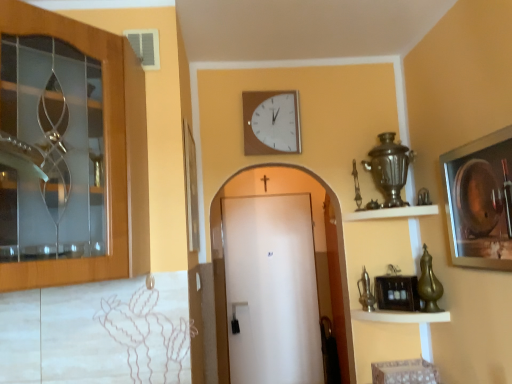
Locate an element on the screen. The height and width of the screenshot is (384, 512). metallic silver picture frame at right is located at coordinates pyautogui.click(x=480, y=201).

Measure the distance between wooden cabinet at left, marked as the 1th door in a front-to-back arrangement, and camera.

1.01 meters.

This screenshot has width=512, height=384. Find the location of `wooden cabinet at left, which appears as the 1th door when viewed from the left`. wooden cabinet at left, which appears as the 1th door when viewed from the left is located at coordinates (105, 154).

What do you see at coordinates (400, 316) in the screenshot? I see `metallic brass shelf at lower right, which is the 2th shelf from top to bottom` at bounding box center [400, 316].

Where is `white matte door at center, the 2th door from the front`? white matte door at center, the 2th door from the front is located at coordinates (315, 250).

How much space does white wooden shelf at upper right, the first shelf in the top-to-bottom sequence, occupy horizontally?

9.81 inches.

Locate an element on the screen. This screenshot has height=384, width=512. metallic silver picture frame at right is located at coordinates (x=480, y=201).

Is white wooden clock at upper center surrounding metallic silver picture frame at right?

Actually, metallic silver picture frame at right is outside white wooden clock at upper center.

Between point (274, 115) and point (453, 231), which one is positioned in front?

The point (453, 231) is more forward.

Considering the relative sizes of white wooden clock at upper center and metallic silver picture frame at right in the image provided, is white wooden clock at upper center shorter than metallic silver picture frame at right?

Indeed, white wooden clock at upper center has a lesser height compared to metallic silver picture frame at right.

Could you tell me if white wooden clock at upper center is turned towards metallic silver picture frame at right?

No, white wooden clock at upper center is not oriented towards metallic silver picture frame at right.

How different are the orientations of white wooden clock at upper center and metallic brass shelf at lower right, arranged as the 1th shelf when ordered from the bottom, in degrees?

0.927 degrees.

Is white wooden clock at upper center not close to metallic brass shelf at lower right, which is the 2th shelf from top to bottom?

white wooden clock at upper center is far away from metallic brass shelf at lower right, which is the 2th shelf from top to bottom.

Choose the correct answer: Is white wooden clock at upper center inside metallic brass shelf at lower right, arranged as the 1th shelf when ordered from the bottom, or outside it?

white wooden clock at upper center is located beyond the bounds of metallic brass shelf at lower right, arranged as the 1th shelf when ordered from the bottom.

Which point is more distant from viewer, (249, 94) or (382, 316)?

Point (249, 94)

From a real-world perspective, between white matte door at center, the first door positioned from the right, and metallic silver picture frame at right, who is vertically higher?

metallic silver picture frame at right is physically above.

Which is more to the left, white matte door at center, the first door in the bottom-to-top sequence, or metallic silver picture frame at right?

white matte door at center, the first door in the bottom-to-top sequence.

Is white matte door at center, the first door positioned from the right, far away from metallic silver picture frame at right?

Yes, white matte door at center, the first door positioned from the right, is far from metallic silver picture frame at right.

Is wooden cabinet at left, the 2th door viewed from the back, inside the boundaries of white wooden shelf at upper right, which appears as the second shelf when ordered from the bottom, or outside?

wooden cabinet at left, the 2th door viewed from the back, is spatially situated outside white wooden shelf at upper right, which appears as the second shelf when ordered from the bottom.

Considering the sizes of wooden cabinet at left, the 2th door viewed from the right, and white wooden shelf at upper right, which appears as the second shelf when ordered from the bottom, in the image, is wooden cabinet at left, the 2th door viewed from the right, bigger or smaller than white wooden shelf at upper right, which appears as the second shelf when ordered from the bottom,?

In the image, wooden cabinet at left, the 2th door viewed from the right, appears to be larger than white wooden shelf at upper right, which appears as the second shelf when ordered from the bottom.

From a real-world perspective, which object rests below the other?

white wooden shelf at upper right, which appears as the second shelf when ordered from the bottom.

Considering the relative sizes of white wooden clock at upper center and white wooden shelf at upper right, which appears as the second shelf when ordered from the bottom, in the image provided, is white wooden clock at upper center bigger than white wooden shelf at upper right, which appears as the second shelf when ordered from the bottom,?

Actually, white wooden clock at upper center might be smaller than white wooden shelf at upper right, which appears as the second shelf when ordered from the bottom.

From a real-world perspective, which object stands above the other?

In real-world perspective, white wooden clock at upper center is above.

From their relative heights in the image, would you say white wooden clock at upper center is taller or shorter than white wooden shelf at upper right, the first shelf in the top-to-bottom sequence?

Clearly, white wooden clock at upper center is taller compared to white wooden shelf at upper right, the first shelf in the top-to-bottom sequence.

From the image's perspective, starting from the white wooden clock at upper center, which shelf is the 1st one below? Please provide its 2D coordinates.

[(392, 213)]

Is wooden cabinet at left, which appears as the 1th door when viewed from the left, situated inside white wooden clock at upper center or outside?

wooden cabinet at left, which appears as the 1th door when viewed from the left, is spatially situated outside white wooden clock at upper center.

Is the depth of wooden cabinet at left, which appears as the 1th door when viewed from the left, greater than that of white wooden clock at upper center?

No, it is not.

Based on their sizes in the image, would you say wooden cabinet at left, the 2th door viewed from the back, is bigger or smaller than white wooden clock at upper center?

Considering their sizes, wooden cabinet at left, the 2th door viewed from the back, takes up more space than white wooden clock at upper center.

From a real-world perspective, is wooden cabinet at left, the 2th door viewed from the right, below white wooden clock at upper center?

Correct, in the physical world, wooden cabinet at left, the 2th door viewed from the right, is lower than white wooden clock at upper center.

From a real-world perspective, is metallic silver picture frame at right below white matte door at center, the first door in the bottom-to-top sequence?

No, from a real-world perspective, metallic silver picture frame at right is not beneath white matte door at center, the first door in the bottom-to-top sequence.

Considering the relative sizes of metallic silver picture frame at right and white matte door at center, the first door viewed from the back, in the image provided, is metallic silver picture frame at right wider than white matte door at center, the first door viewed from the back,?

In fact, metallic silver picture frame at right might be narrower than white matte door at center, the first door viewed from the back.

Is white matte door at center, the 2th door from the front, completely or partially inside metallic silver picture frame at right?

Definitely not — white matte door at center, the 2th door from the front, is not inside metallic silver picture frame at right.

Is point (510, 136) closer to viewer compared to point (216, 236)?

Yes, point (510, 136) is closer to viewer.

The height and width of the screenshot is (384, 512). I want to click on wall clock on the left of metallic silver picture frame at right, so click(271, 122).

Find the location of a particular element. Image resolution: width=512 pixels, height=384 pixels. wall clock that is behind the metallic brass shelf at lower right, which is the 2th shelf from top to bottom is located at coordinates (271, 122).

From the image, which object appears to be farther from metallic brass shelf at lower right, arranged as the 1th shelf when ordered from the bottom, white wooden shelf at upper right, the first shelf in the top-to-bottom sequence, or white wooden clock at upper center?

Among the two, white wooden clock at upper center is located further to metallic brass shelf at lower right, arranged as the 1th shelf when ordered from the bottom.

Based on their spatial positions, is white matte door at center, the 2th door from the front, or white wooden shelf at upper right, which appears as the second shelf when ordered from the bottom, further from white wooden clock at upper center?

white matte door at center, the 2th door from the front, is positioned further to the anchor white wooden clock at upper center.

Estimate the real-world distances between objects in this image. Which object is closer to metallic brass shelf at lower right, arranged as the 1th shelf when ordered from the bottom, white wooden shelf at upper right, which appears as the second shelf when ordered from the bottom, or metallic silver picture frame at right?

Among the two, white wooden shelf at upper right, which appears as the second shelf when ordered from the bottom, is located nearer to metallic brass shelf at lower right, arranged as the 1th shelf when ordered from the bottom.

When comparing their distances from metallic brass shelf at lower right, which is the 2th shelf from top to bottom, does white wooden clock at upper center or wooden cabinet at left, the 2th door viewed from the right, seem further?

wooden cabinet at left, the 2th door viewed from the right.

When comparing their distances from white matte door at center, the 2th door from the front, does metallic silver picture frame at right or white wooden clock at upper center seem closer?

Among the two, white wooden clock at upper center is located nearer to white matte door at center, the 2th door from the front.

When comparing their distances from white matte door at center, the first door in the bottom-to-top sequence, does white wooden clock at upper center or white wooden shelf at upper right, the first shelf in the top-to-bottom sequence, seem further?

white wooden shelf at upper right, the first shelf in the top-to-bottom sequence.

From the image, which object appears to be nearer to wooden cabinet at left, positioned as the 1th door in top-to-bottom order, metallic silver picture frame at right or metallic brass shelf at lower right, arranged as the 1th shelf when ordered from the bottom?

metallic silver picture frame at right is positioned closer to the anchor wooden cabinet at left, positioned as the 1th door in top-to-bottom order.

Looking at the image, which one is located further to metallic brass shelf at lower right, which is the 2th shelf from top to bottom, white matte door at center, the first door viewed from the back, or white wooden clock at upper center?

white matte door at center, the first door viewed from the back, lies further to metallic brass shelf at lower right, which is the 2th shelf from top to bottom, than the other object.

Locate an element on the screen. The image size is (512, 384). shelf positioned between metallic brass shelf at lower right, which is the 2th shelf from top to bottom, and white matte door at center, the first door viewed from the back, from near to far is located at coordinates (392, 213).

This screenshot has width=512, height=384. I want to click on shelf situated between wooden cabinet at left, positioned as the 1th door in top-to-bottom order, and metallic brass shelf at lower right, which is the 2th shelf from top to bottom, from left to right, so click(392, 213).

You are a GUI agent. You are given a task and a screenshot of the screen. Output one action in this format:
    pyautogui.click(x=<x>, y=<y>)
    Task: Click on the picture frame between wooden cabinet at left, positioned as the 1th door in top-to-bottom order, and white matte door at center, the first door viewed from the back, from front to back
    The image size is (512, 384).
    Given the screenshot: What is the action you would take?
    pyautogui.click(x=480, y=201)

Find the location of a particular element. wall clock between metallic brass shelf at lower right, which is the 2th shelf from top to bottom, and white matte door at center, the first door viewed from the back, along the z-axis is located at coordinates (271, 122).